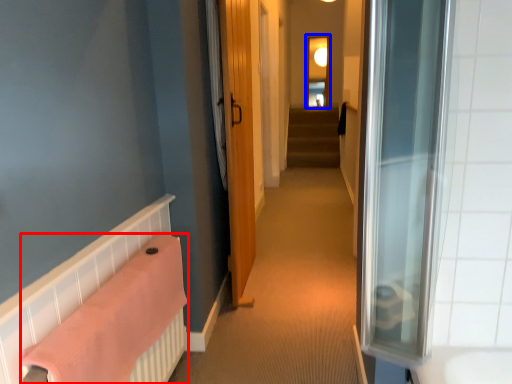
Question: Which object appears farthest to the camera in this image, bath towel (highlighted by a red box) or window (highlighted by a blue box)?

Choices:
 (A) bath towel
 (B) window

Answer: (B)